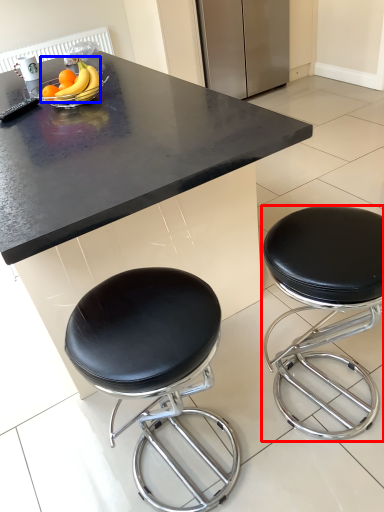
Question: Which of the following is the closest to the observer, stool (highlighted by a red box) or banana (highlighted by a blue box)?

Choices:
 (A) stool
 (B) banana

Answer: (A)